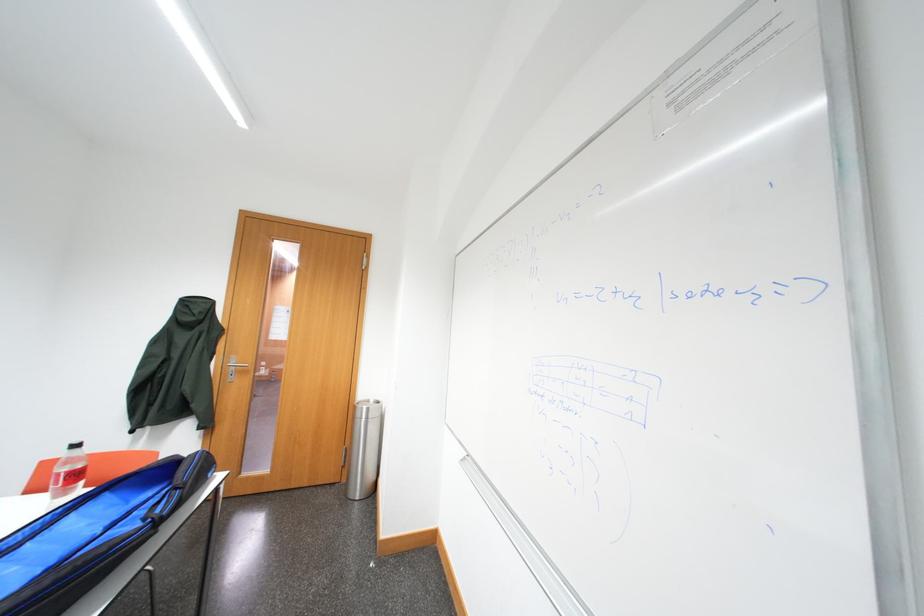
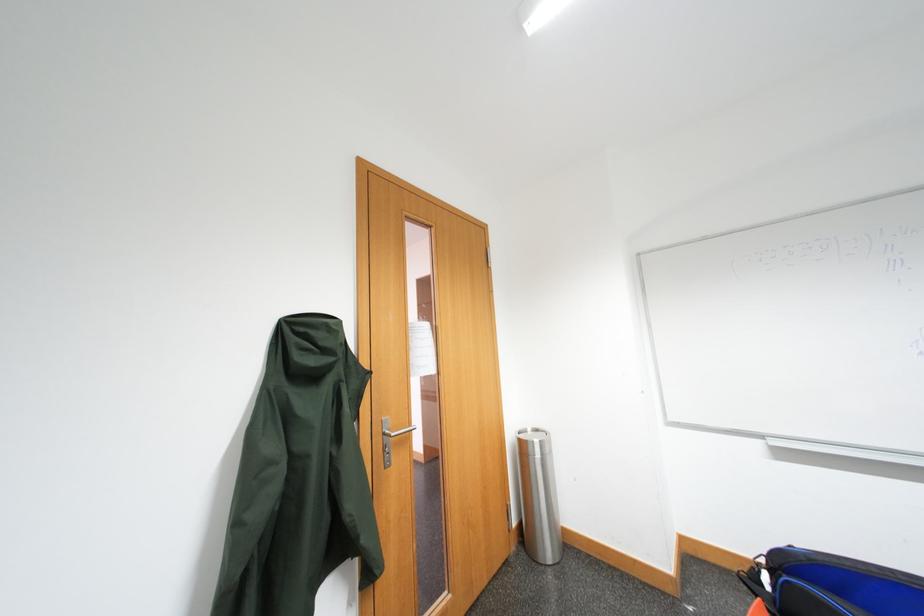
What movement of the cameraman would produce the second image?

The movement direction of the cameraman is left, forward.